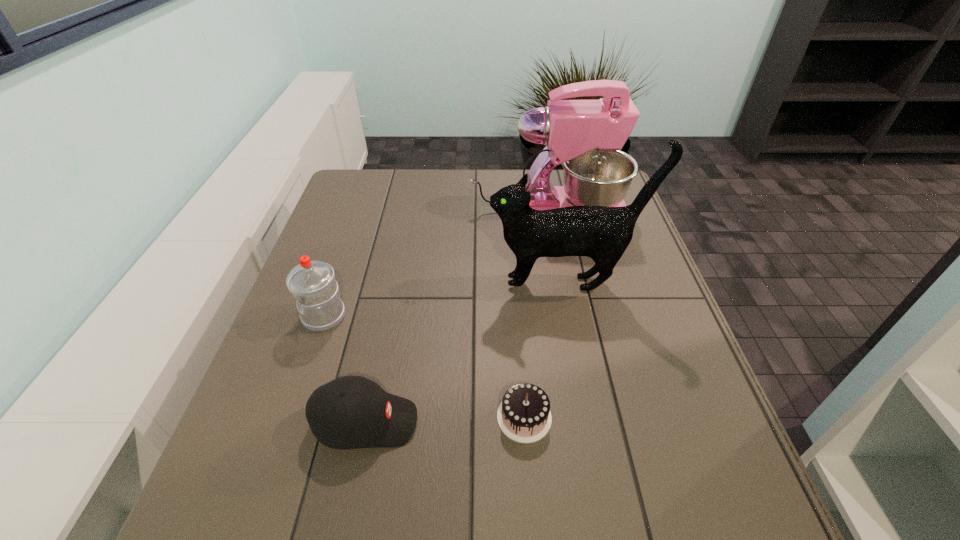
I want to click on vacant area located 0.090m on the front of the chocolate cake, so 530,494.

Find the location of `object that is at the far edge`. object that is at the far edge is located at coordinates (585, 136).

The height and width of the screenshot is (540, 960). Find the location of `water bottle at the left edge`. water bottle at the left edge is located at coordinates (312, 283).

Locate an element on the screen. This screenshot has height=540, width=960. baseball cap positioned at the left edge is located at coordinates (350, 412).

Identify the location of cat present at the right edge. This screenshot has height=540, width=960. (602, 233).

This screenshot has height=540, width=960. In order to click on mixer positioned at the right edge in this screenshot , I will do `click(585, 136)`.

Locate an element on the screen. object that is positioned at the far right corner is located at coordinates (585, 136).

Where is `free space at the far edge`? free space at the far edge is located at coordinates 417,172.

I want to click on vacant space at the left edge of the desktop, so click(355, 208).

The image size is (960, 540). In order to click on free space at the right edge of the desktop in this screenshot , I will do `click(649, 282)`.